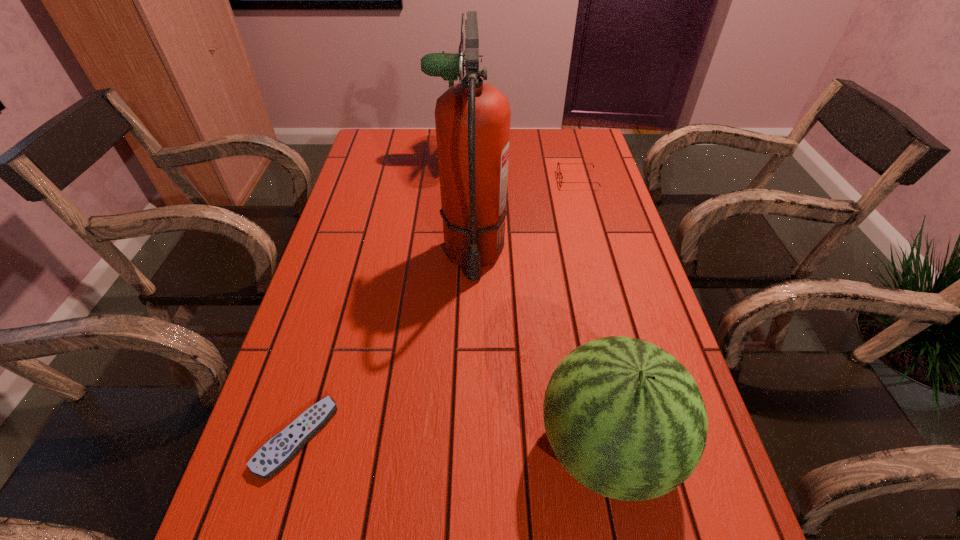
The image size is (960, 540). I want to click on the third farthest object, so click(472, 118).

This screenshot has height=540, width=960. I want to click on the tallest object, so click(472, 118).

Identify the location of the second tallest object. Image resolution: width=960 pixels, height=540 pixels. point(434,64).

Locate an element on the screen. This screenshot has height=540, width=960. the third tallest object is located at coordinates (625, 418).

You are a GUI agent. You are given a task and a screenshot of the screen. Output one action in this format:
    pyautogui.click(x=<x>, y=<y>)
    Task: Click on the sunglasses
    
    Given the screenshot: What is the action you would take?
    pyautogui.click(x=558, y=167)

Locate an element on the screen. The width and height of the screenshot is (960, 540). remote control is located at coordinates (278, 451).

Image resolution: width=960 pixels, height=540 pixels. I want to click on the leftmost object, so click(278, 451).

Where is `free space located 0.230m on the nozzle of the fire extinguisher`? free space located 0.230m on the nozzle of the fire extinguisher is located at coordinates (472, 377).

At what (x,y) coordinates should I click in order to perform the action: click on vacant area located on the front-facing side of the fan. Please return your answer as a coordinate pair (x, y). Looking at the image, I should click on [495, 157].

You are a GUI agent. You are given a task and a screenshot of the screen. Output one action in this format:
    pyautogui.click(x=<x>, y=<y>)
    Task: Click on the free space located 0.230m on the left of the third shortest object
    
    Given the screenshot: What is the action you would take?
    (408, 448)